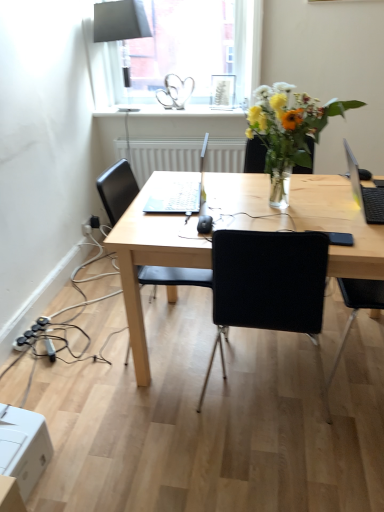
The width and height of the screenshot is (384, 512). Identify the location of vacant space to the right of sleek silver laptop at center. pyautogui.click(x=233, y=197).